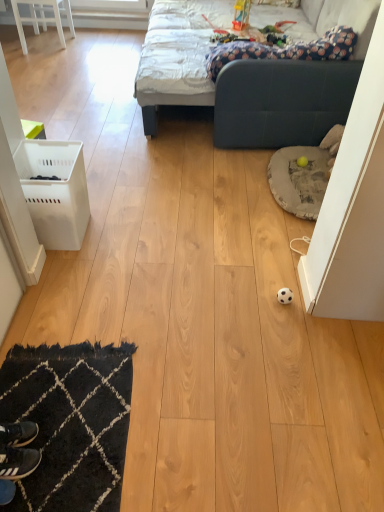
Question: From a real-world perspective, is black leather shoe at lower left positioned over white plastic laundry basket at left based on gravity?

Choices:
 (A) no
 (B) yes

Answer: (A)

Question: Can you confirm if black leather shoe at lower left is smaller than white plastic laundry basket at left?

Choices:
 (A) yes
 (B) no

Answer: (A)

Question: Is black leather shoe at lower left positioned far away from white plastic laundry basket at left?

Choices:
 (A) yes
 (B) no

Answer: (A)

Question: From the image's perspective, is black leather shoe at lower left on white plastic laundry basket at left?

Choices:
 (A) no
 (B) yes

Answer: (A)

Question: Is the position of black leather shoe at lower left more distant than that of white plastic laundry basket at left?

Choices:
 (A) yes
 (B) no

Answer: (B)

Question: Looking at the image, does white glossy chair at upper left seem bigger or smaller compared to black leather shoe at lower left?

Choices:
 (A) big
 (B) small

Answer: (A)

Question: In terms of height, does white glossy chair at upper left look taller or shorter compared to black leather shoe at lower left?

Choices:
 (A) tall
 (B) short

Answer: (A)

Question: Based on their positions, is white glossy chair at upper left located to the left or right of black leather shoe at lower left?

Choices:
 (A) right
 (B) left

Answer: (B)

Question: In the image, is white glossy chair at upper left positioned in front of or behind black leather shoe at lower left?

Choices:
 (A) behind
 (B) front

Answer: (A)

Question: Is black leather shoe at lower left in front of or behind white glossy chair at upper left in the image?

Choices:
 (A) behind
 (B) front

Answer: (B)

Question: In terms of width, does black leather shoe at lower left look wider or thinner when compared to white glossy chair at upper left?

Choices:
 (A) thin
 (B) wide

Answer: (A)

Question: Considering the positions of black leather shoe at lower left and white glossy chair at upper left in the image, is black leather shoe at lower left bigger or smaller than white glossy chair at upper left?

Choices:
 (A) small
 (B) big

Answer: (A)

Question: Considering the positions of black leather shoe at lower left and white glossy chair at upper left in the image, is black leather shoe at lower left taller or shorter than white glossy chair at upper left?

Choices:
 (A) short
 (B) tall

Answer: (A)

Question: Would you say white glossy chair at upper left is inside or outside white plastic laundry basket at left?

Choices:
 (A) outside
 (B) inside

Answer: (A)

Question: Looking at the image, does white glossy chair at upper left seem bigger or smaller compared to white plastic laundry basket at left?

Choices:
 (A) small
 (B) big

Answer: (B)